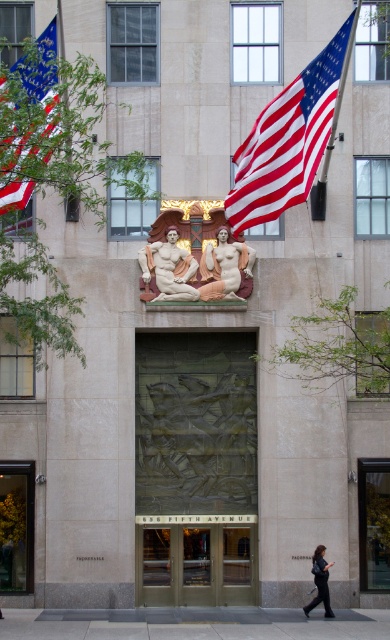
Question: Which object is closer to the camera taking this photo?

Choices:
 (A) matte bronze statue at center
 (B) marble nude figures at center
 (C) bronze door at center

Answer: (B)

Question: Can you confirm if gold/glass doors at center is smaller than dark gray pants at lower center?

Choices:
 (A) no
 (B) yes

Answer: (A)

Question: Which object is closer to the camera taking this photo?

Choices:
 (A) bronze door at center
 (B) gold/glass doors at center

Answer: (A)

Question: Does bronze relief at center appear over bronze relief sculpture at center?

Choices:
 (A) yes
 (B) no

Answer: (A)

Question: Does bronze door at center have a larger size compared to matte bronze statue at center?

Choices:
 (A) no
 (B) yes

Answer: (B)

Question: Which point is farther from the camera taking this photo?

Choices:
 (A) (365, 586)
 (B) (200, 536)
 (C) (19, 209)
 (D) (326, 593)

Answer: (B)